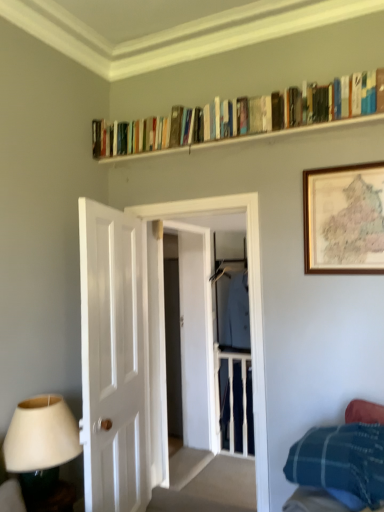
This screenshot has height=512, width=384. I want to click on empty space that is ontop of wooden bookshelf at upper center (from a real-world perspective), so click(220, 143).